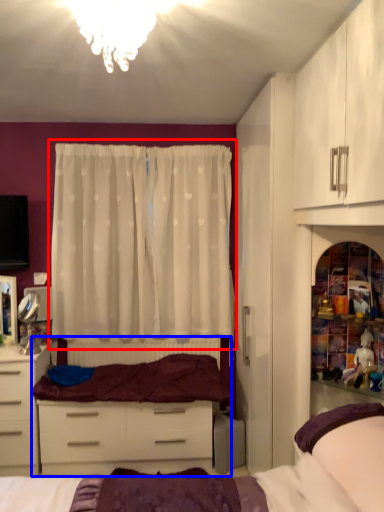
Question: Which point is closer to the camera, curtain (highlighted by a red box) or entertainment center (highlighted by a blue box)?

Choices:
 (A) curtain
 (B) entertainment center

Answer: (B)